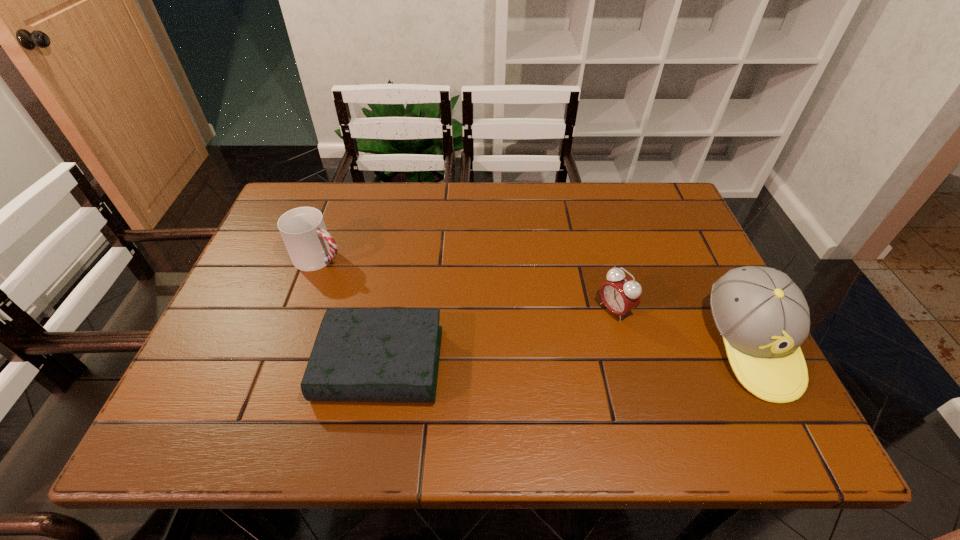
This screenshot has width=960, height=540. I want to click on the shortest object, so click(360, 354).

Find the location of `the third object from right to left`. the third object from right to left is located at coordinates (360, 354).

Identify the location of baseball cap. (763, 317).

This screenshot has height=540, width=960. What are the coordinates of `the rightmost object` in the screenshot? It's located at (763, 317).

Where is `the farthest object`? This screenshot has height=540, width=960. the farthest object is located at coordinates (310, 247).

The width and height of the screenshot is (960, 540). In order to click on cup in this screenshot , I will do `click(310, 247)`.

This screenshot has height=540, width=960. I want to click on alarm clock, so click(620, 294).

The image size is (960, 540). In order to click on free space located on the back of the shortest object in this screenshot , I will do `click(402, 244)`.

I want to click on vacant space located on the handle side of the leftmost object, so pyautogui.click(x=372, y=278).

This screenshot has height=540, width=960. What are the coordinates of `vacant space located on the handle side of the leftmost object` in the screenshot? It's located at (473, 321).